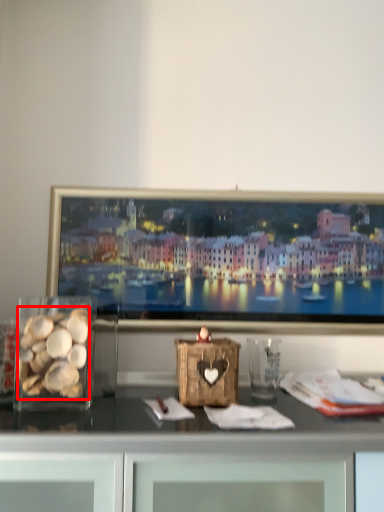
Question: From the image's perspective, where is food (annotated by the red box) located in relation to glass vase in the image?

Choices:
 (A) below
 (B) above

Answer: (B)